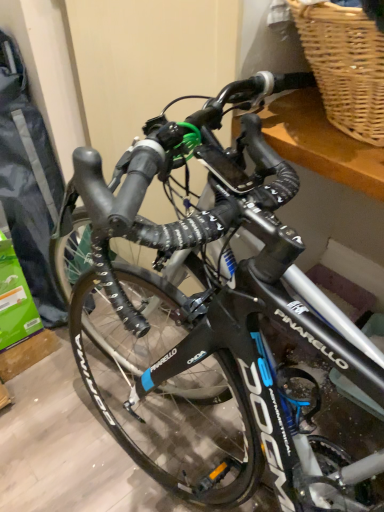
Find the location of `woven wicker picnic basket at upper right`. woven wicker picnic basket at upper right is located at coordinates (345, 66).

What do you see at coordinates (345, 66) in the screenshot?
I see `woven wicker picnic basket at upper right` at bounding box center [345, 66].

Find the location of a particular element. The image size is (384, 512). woven wicker picnic basket at upper right is located at coordinates (345, 66).